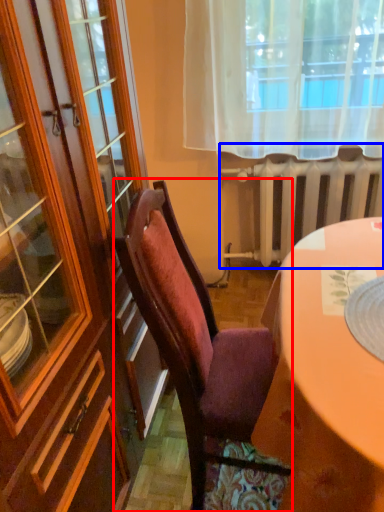
Question: Which object is closer to the camera taking this photo, chair (highlighted by a red box) or radiator (highlighted by a blue box)?

Choices:
 (A) chair
 (B) radiator

Answer: (A)